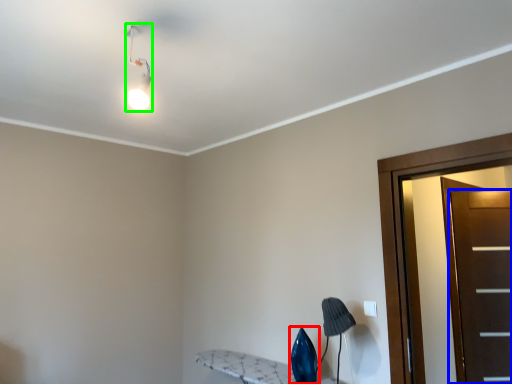
Question: Which object is the closest to the swivel chair (highlighted by a red box)? Choose among these: door (highlighted by a blue box) or light fixture (highlighted by a green box).

Choices:
 (A) door
 (B) light fixture

Answer: (A)